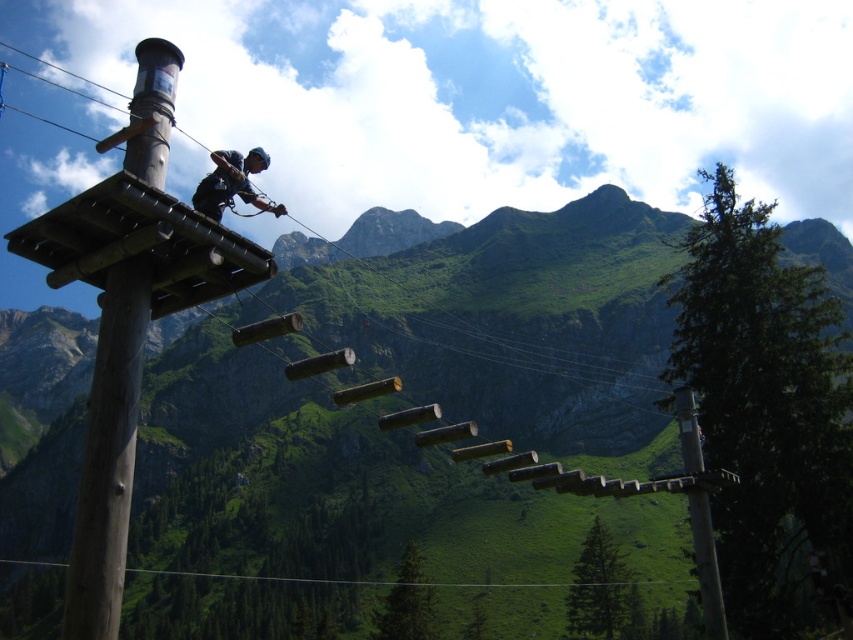
Question: Among these objects, which one is nearest to the camera?

Choices:
 (A) dark blue fabric harness at center
 (B) brown wooden pole at upper left

Answer: (B)

Question: Is brown wooden pole at upper left bigger than dark blue fabric harness at center?

Choices:
 (A) yes
 (B) no

Answer: (B)

Question: Which object is closer to the camera taking this photo?

Choices:
 (A) brown wooden pole at upper left
 (B) dark blue fabric harness at center

Answer: (A)

Question: From the image, what is the correct spatial relationship of brown wooden pole at upper left in relation to dark blue fabric harness at center?

Choices:
 (A) right
 (B) left

Answer: (A)

Question: Can you confirm if brown wooden pole at upper left is thinner than dark blue fabric harness at center?

Choices:
 (A) yes
 (B) no

Answer: (A)